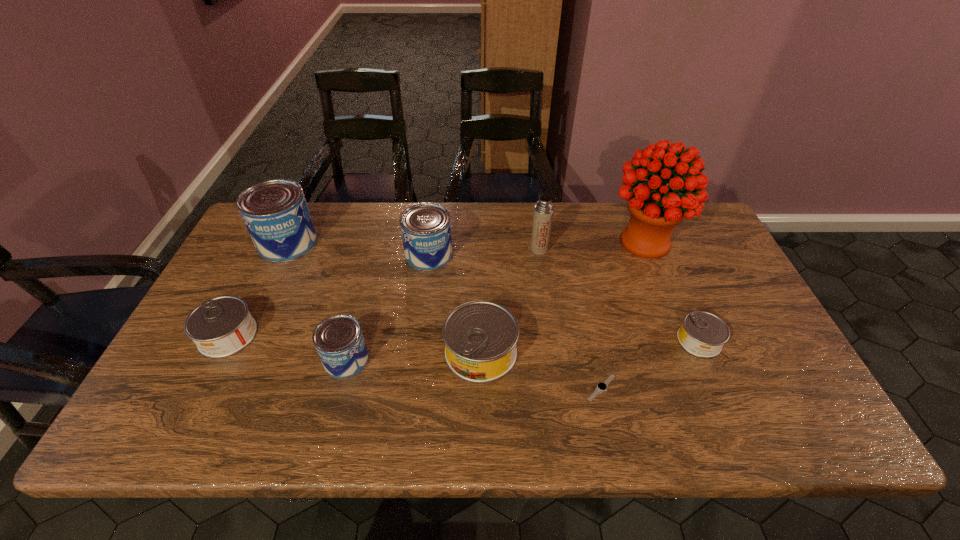
Where is `free location located on the back of the second silver can from right to left`? This screenshot has width=960, height=540. free location located on the back of the second silver can from right to left is located at coordinates (481, 241).

This screenshot has height=540, width=960. What are the coordinates of `free space located on the right of the seventh tallest object` in the screenshot? It's located at (315, 335).

You are a GUI agent. You are given a task and a screenshot of the screen. Output one action in this format:
    pyautogui.click(x=<x>, y=<y>)
    Task: Click on the vacant point located on the back of the rightmost can
    The width and height of the screenshot is (960, 540).
    Given the screenshot: What is the action you would take?
    pyautogui.click(x=670, y=273)

Locate an element on the screen. vacant space situated 0.270m on the left of the third object from right to left is located at coordinates (468, 388).

Find the location of a particular element. The width and height of the screenshot is (960, 540). bouquet situated at the far edge is located at coordinates (655, 208).

Where is `thermos bottle located in the far edge section of the desktop`? This screenshot has height=540, width=960. thermos bottle located in the far edge section of the desktop is located at coordinates (543, 211).

Where is `bouquet that is positioned at the right edge`? The image size is (960, 540). bouquet that is positioned at the right edge is located at coordinates (655, 208).

Find the location of `can located in the right edge section of the desktop`. can located in the right edge section of the desktop is located at coordinates (702, 334).

Locate an element on the screen. The image size is (960, 540). object that is at the far left corner is located at coordinates (275, 212).

Find the location of a particular element. This screenshot has height=540, width=960. object located at the far right corner is located at coordinates (655, 208).